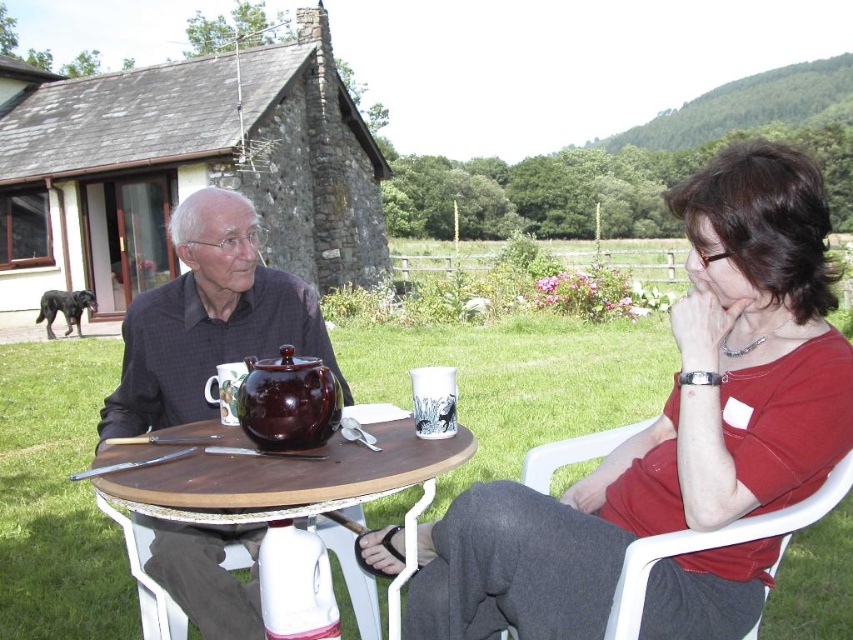
Question: Does white plastic chair at right have a greater width compared to brown glossy teapot at center?

Choices:
 (A) no
 (B) yes

Answer: (B)

Question: Among these points, which one is nearest to the camera?

Choices:
 (A) (231, 273)
 (B) (445, 628)

Answer: (B)

Question: Among these points, which one is nearest to the camera?

Choices:
 (A) (247, 316)
 (B) (248, 371)
 (C) (144, 454)
 (D) (521, 476)

Answer: (B)

Question: Does matte black shirt at center have a greater width compared to white plastic chair at right?

Choices:
 (A) no
 (B) yes

Answer: (B)

Question: Does matte black shirt at center appear on the left side of brown glossy teapot at center?

Choices:
 (A) no
 (B) yes

Answer: (B)

Question: Which of the following is the closest to the observer?

Choices:
 (A) (349, 410)
 (B) (189, 280)

Answer: (A)